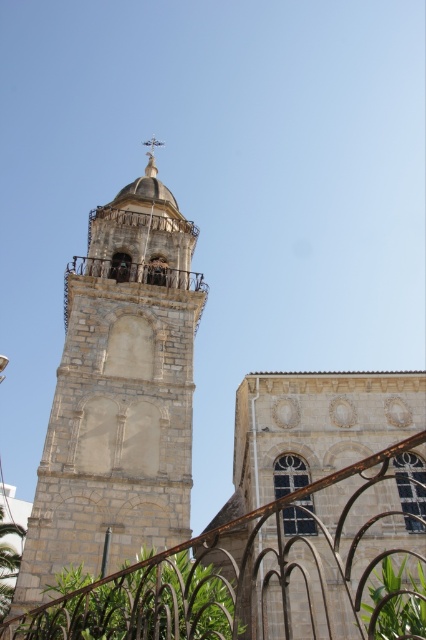
Question: Which object is farther from the camera taking this photo?

Choices:
 (A) rusty metal fence at lower left
 (B) white stone spire at upper center

Answer: (B)

Question: Is beige stone tower at center further to camera compared to white stone spire at upper center?

Choices:
 (A) no
 (B) yes

Answer: (A)

Question: Which of the following is the farthest from the observer?

Choices:
 (A) beige stone tower at center
 (B) rusty metal fence at lower left

Answer: (A)

Question: Does beige stone tower at center appear on the right side of white stone spire at upper center?

Choices:
 (A) yes
 (B) no

Answer: (A)

Question: Is rusty metal fence at lower left positioned behind white stone spire at upper center?

Choices:
 (A) yes
 (B) no

Answer: (B)

Question: Considering the real-world distances, which object is closest to the white stone spire at upper center?

Choices:
 (A) rusty metal fence at lower left
 (B) beige stone tower at center

Answer: (B)